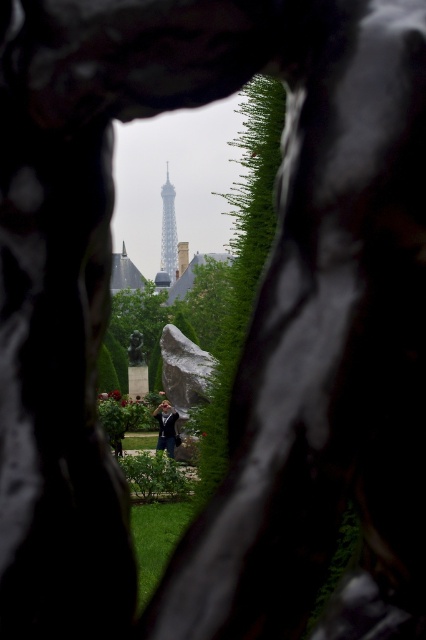
You are a photographer standing in the garden and want to take a photo of both the point at coordinates point (x=164, y=257) and point (x=178, y=417). Since you want both points to be in focus, which point should you focus on first to ensure the other is also in focus?

You should focus on point (x=164, y=257) first because it is closer to the camera than point (x=178, y=417). By focusing on the closer point, the farther point will also be in focus due to the depth of field extending beyond it.

You are a photographer standing in the garden. You want to take a photo of the silver metallic eiffel tower at center and the dark blue fabric jacket at center. Which object is closer to your camera lens?

The silver metallic eiffel tower at center is closer to the camera lens because it is further to the viewer than the dark blue fabric jacket at center.